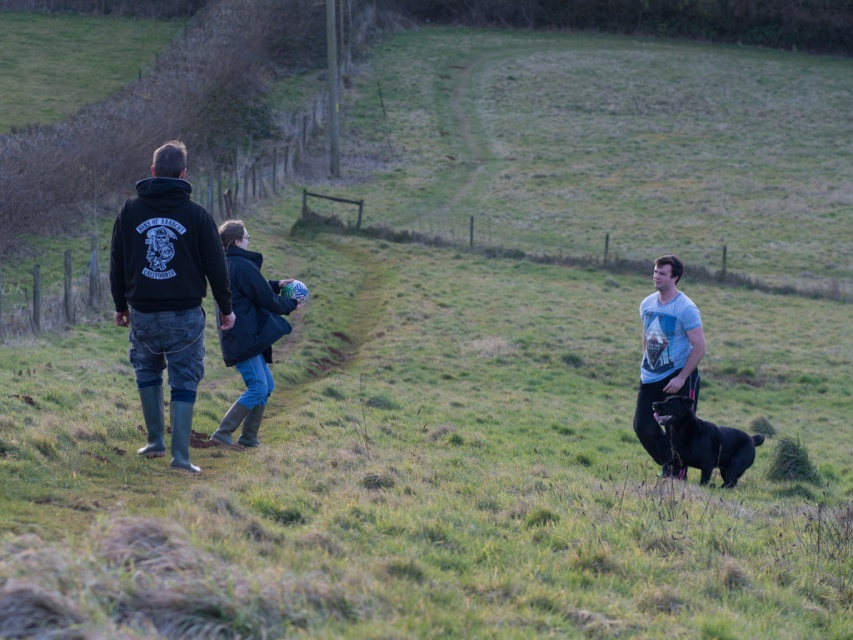
Which is behind, point (250, 371) or point (669, 416)?

The point (250, 371) is more distant.

Who is shorter, dark blue denim jeans at center or shiny black dog at lower right?

Standing shorter between the two is shiny black dog at lower right.

The width and height of the screenshot is (853, 640). Identify the location of dark blue denim jeans at center. (248, 332).

From the picture: Can you confirm if black matte hoodie at left is positioned above dark blue denim jeans at center?

Yes, black matte hoodie at left is above dark blue denim jeans at center.

Can you confirm if black matte hoodie at left is shorter than dark blue denim jeans at center?

No.

Between point (149, 282) and point (270, 317), which one is positioned behind?

The point (270, 317) is behind.

Identify the location of black matte hoodie at left. (166, 294).

Is dark blue denim jeans at center to the left of light blue t-shirt at center from the viewer's perspective?

Indeed, dark blue denim jeans at center is positioned on the left side of light blue t-shirt at center.

Who is positioned more to the left, dark blue denim jeans at center or light blue t-shirt at center?

dark blue denim jeans at center is more to the left.

Which is in front, point (248, 419) or point (663, 324)?

Positioned in front is point (248, 419).

You are a GUI agent. You are given a task and a screenshot of the screen. Output one action in this format:
    pyautogui.click(x=<x>, y=<y>)
    Task: Click on the dark blue denim jeans at center
    The height and width of the screenshot is (640, 853).
    Given the screenshot: What is the action you would take?
    pyautogui.click(x=248, y=332)